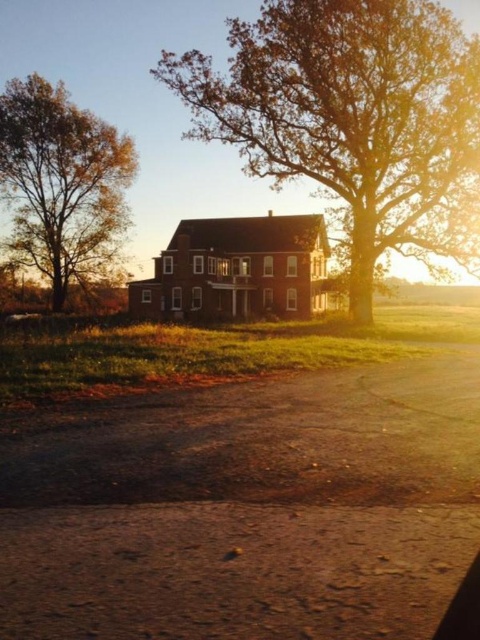
Question: Is dusty brown dirt track at lower center below brown brick barn at center?

Choices:
 (A) yes
 (B) no

Answer: (A)

Question: Estimate the real-world distances between objects in this image. Which object is closer to the brown brick barn at center?

Choices:
 (A) golden brown bark tree at left
 (B) dusty brown dirt track at lower center

Answer: (A)

Question: Does brown textured tree at center appear on the right side of brown brick barn at center?

Choices:
 (A) no
 (B) yes

Answer: (B)

Question: Which object appears farthest from the camera in this image?

Choices:
 (A) brown brick barn at center
 (B) brown textured tree at center

Answer: (A)

Question: Among these objects, which one is nearest to the camera?

Choices:
 (A) brown textured tree at center
 (B) dusty brown dirt track at lower center
 (C) brown brick barn at center
 (D) golden brown bark tree at left

Answer: (B)

Question: Can you confirm if brown textured tree at center is smaller than brown brick barn at center?

Choices:
 (A) no
 (B) yes

Answer: (A)